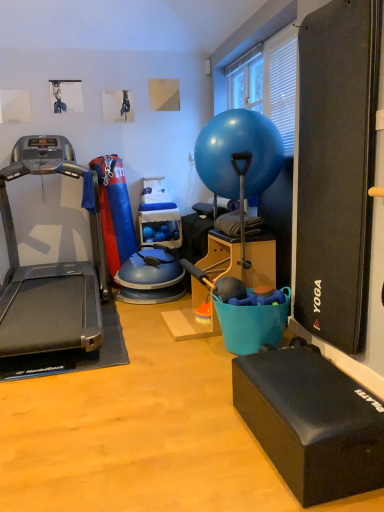
Question: Considering the positions of black rubber yoga block at lower right, the first box when ordered from bottom to top, and metallic gray treadmill at left in the image, is black rubber yoga block at lower right, the first box when ordered from bottom to top, bigger or smaller than metallic gray treadmill at left?

Choices:
 (A) small
 (B) big

Answer: (A)

Question: Is point (352, 397) closer or farther from the camera than point (99, 304)?

Choices:
 (A) closer
 (B) farther

Answer: (A)

Question: Which object is the farthest from the metallic gray treadmill at left?

Choices:
 (A) teal plastic bucket at center, marked as the 2th box in a bottom-to-top arrangement
 (B) glossy rubber ball at center
 (C) black rubber yoga block at lower right, the first box when ordered from bottom to top

Answer: (C)

Question: Which of these objects is positioned closest to the metallic gray treadmill at left?

Choices:
 (A) black rubber yoga block at lower right, the 2th box positioned from the top
 (B) teal plastic bucket at center, which ranks as the first box in back-to-front order
 (C) glossy rubber ball at center

Answer: (B)